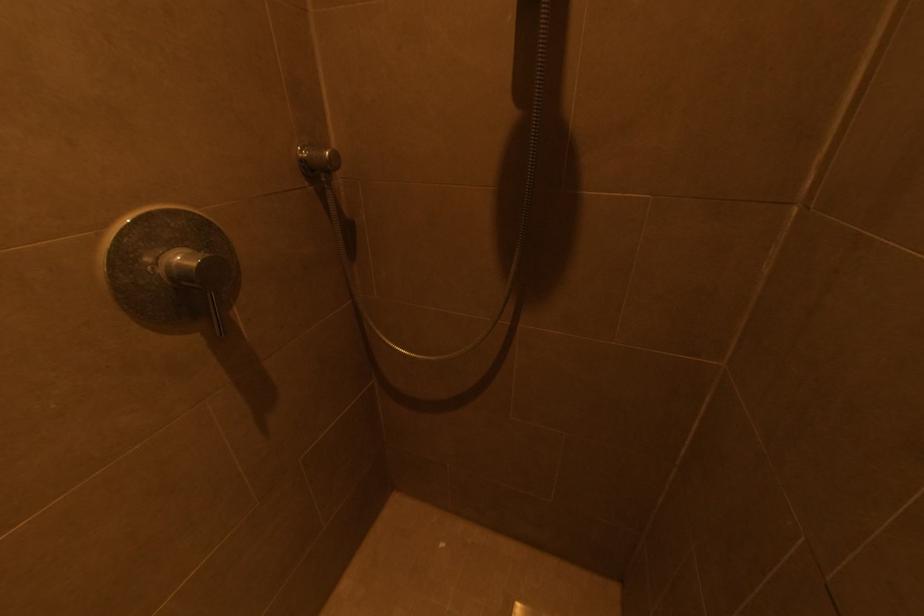
Find the location of a particular element. Image resolution: width=924 pixels, height=616 pixels. shower control handle is located at coordinates (171, 268).